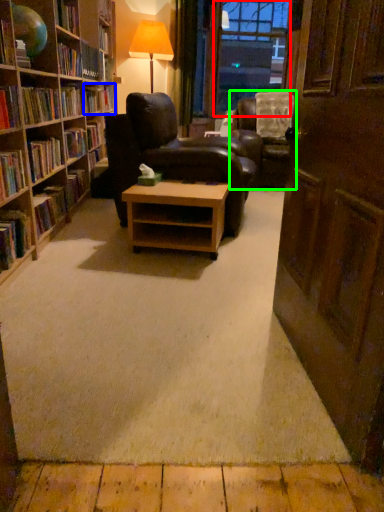
Question: Based on their relative distances, which object is farther from window screen (highlighted by a red box)? Choose from book (highlighted by a blue box) and chair (highlighted by a green box).

Choices:
 (A) book
 (B) chair

Answer: (A)